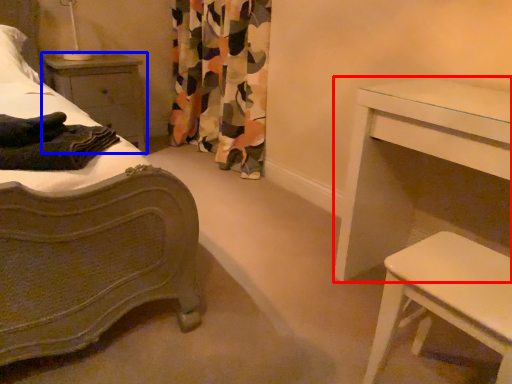
Question: Which of the following is the closest to the observer, table (highlighted by a red box) or nightstand (highlighted by a blue box)?

Choices:
 (A) table
 (B) nightstand

Answer: (A)